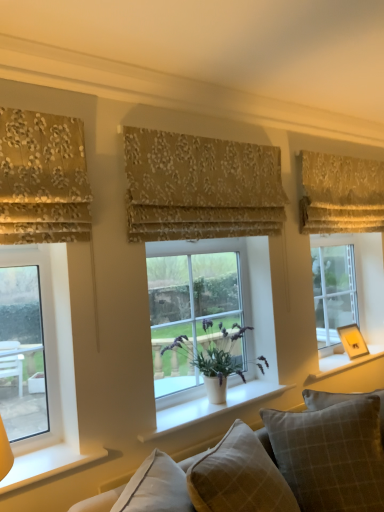
Question: From the image's perspective, is clear glass window at right, the 3th window positioned from the left, located above or below gold floral fabric at upper left, the first curtain when ordered from front to back?

Choices:
 (A) below
 (B) above

Answer: (A)

Question: Considering their positions, is clear glass window at right, which is counted as the 1th window, starting from the back, located in front of or behind gold floral fabric at upper left, marked as the first curtain in a left-to-right arrangement?

Choices:
 (A) front
 (B) behind

Answer: (B)

Question: Estimate the real-world distances between objects in this image. Which object is farther from the clear glass window at right, which is counted as the 1th window, starting from the back?

Choices:
 (A) clear glass window at left, which appears as the first window when viewed from the left
 (B) plaid fabric pillow at center, marked as the second pillow in a right-to-left arrangement
 (C) white matte pot at center
 (D) gold floral fabric at upper right, which is the 3th curtain from front to back
 (E) white smooth window sill at lower left, which is counted as the 3th window sill, starting from the right

Answer: (A)

Question: Considering the real-world distances, which object is closest to the beige floral fabric at center, which appears as the 2th curtain when viewed from the right?

Choices:
 (A) white smooth window sill at center, the second window sill from the left
 (B) gold floral fabric at upper right, the 1th curtain viewed from the back
 (C) clear glass window at left, which is the third window from back to front
 (D) plaid fabric pillow at center, arranged as the first pillow when viewed from the left
 (E) white matte pot at center

Answer: (B)